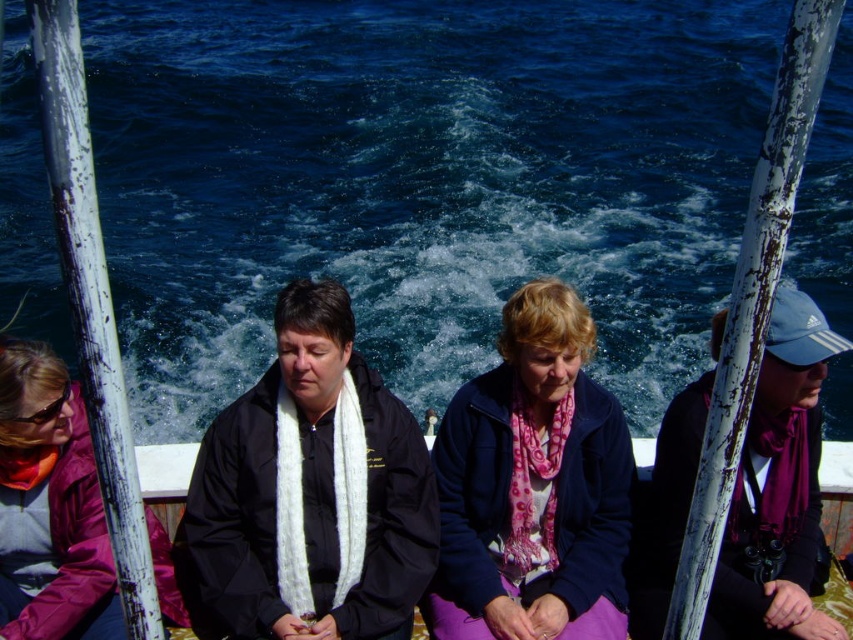
Question: Is blue water at center above matte black jacket at center?

Choices:
 (A) yes
 (B) no

Answer: (A)

Question: Is blue water at center to the left of matte pink jacket at left from the viewer's perspective?

Choices:
 (A) yes
 (B) no

Answer: (B)

Question: Which object is positioned farthest from the blue water at center?

Choices:
 (A) black matte jacket at center
 (B) pink fabric scarf at center
 (C) matte pink jacket at left
 (D) matte black jacket at center

Answer: (D)

Question: Which of the following is the closest to the observer?

Choices:
 (A) (79, 545)
 (B) (26, 112)
 (C) (795, 458)
 (D) (212, 628)

Answer: (A)

Question: Is the position of black matte jacket at center more distant than that of matte pink jacket at left?

Choices:
 (A) yes
 (B) no

Answer: (A)

Question: Which of these objects is positioned farthest from the pink fabric scarf at center?

Choices:
 (A) black matte jacket at center
 (B) matte black jacket at center
 (C) blue water at center
 (D) matte pink jacket at left

Answer: (C)